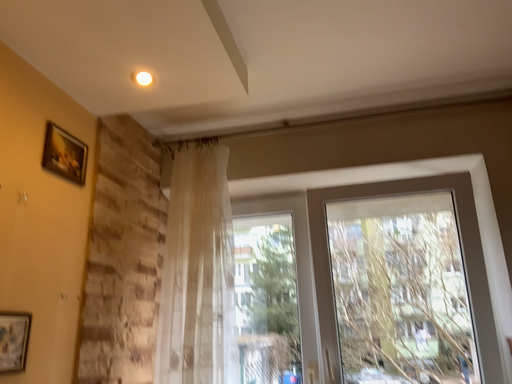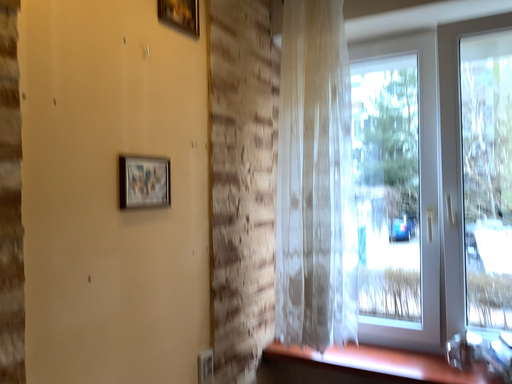
Question: Which way did the camera rotate in the video?

Choices:
 (A) rotated downward
 (B) rotated upward

Answer: (A)